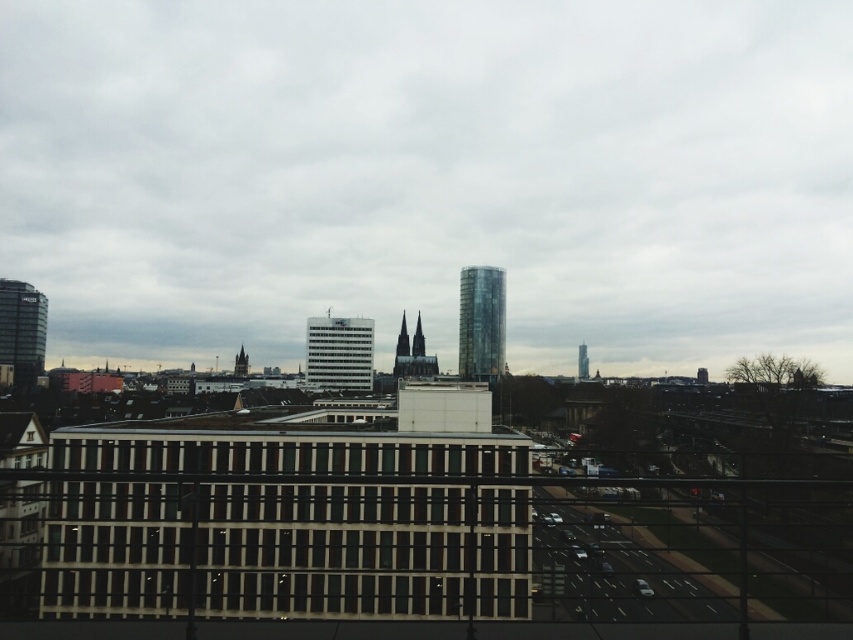
You are standing at a vantage point overlooking the city and notice two points marked in the scene. Which point, point [473,326] or point [315,364], is closer to you?

Point [473,326] is closer to you because it is further to the viewer than point [315,364].

From the picture: You are standing on a balcony overlooking the city. You see the transparent glass tower at center and the dark gray stone cathedral at center. Which one is positioned to the right when viewed from your current vantage point?

The transparent glass tower at center is positioned to the right of the dark gray stone cathedral at center.